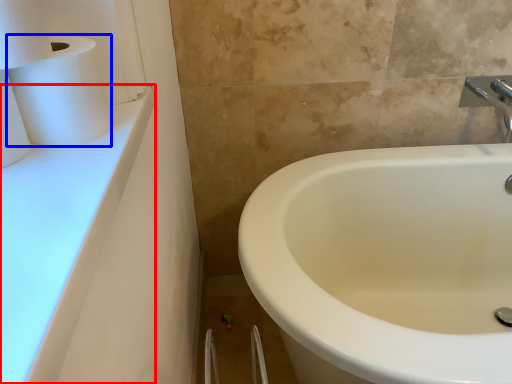
Question: Which object is closer to the camera taking this photo, counter top (highlighted by a red box) or paper towel (highlighted by a blue box)?

Choices:
 (A) counter top
 (B) paper towel

Answer: (A)